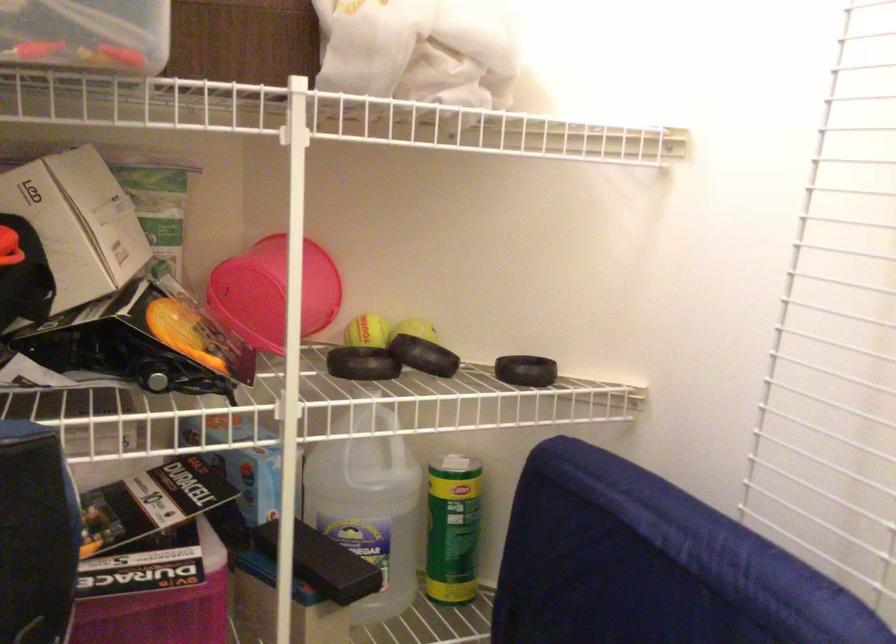
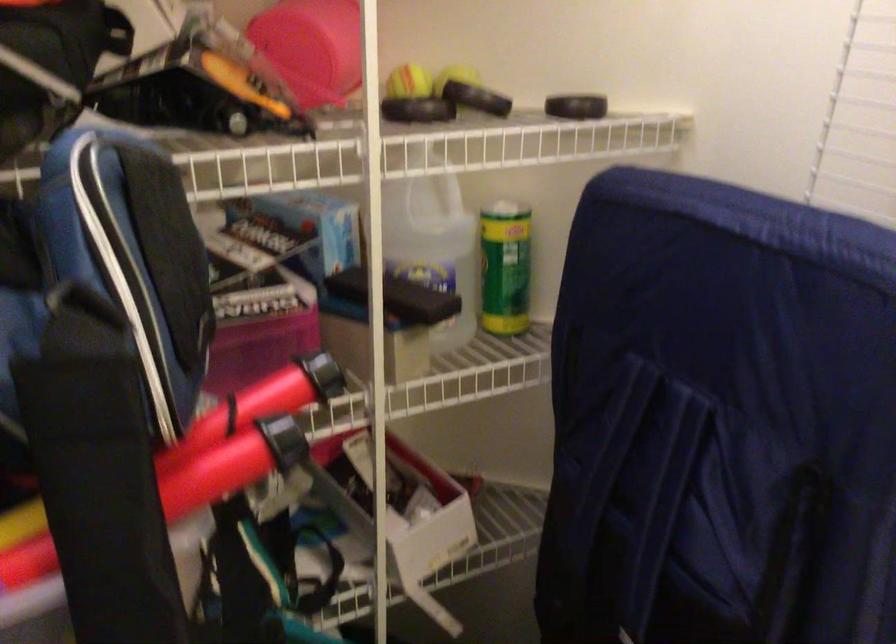
Find the pixel in the second image that matches pixel 448 529 in the first image.

(504, 267)